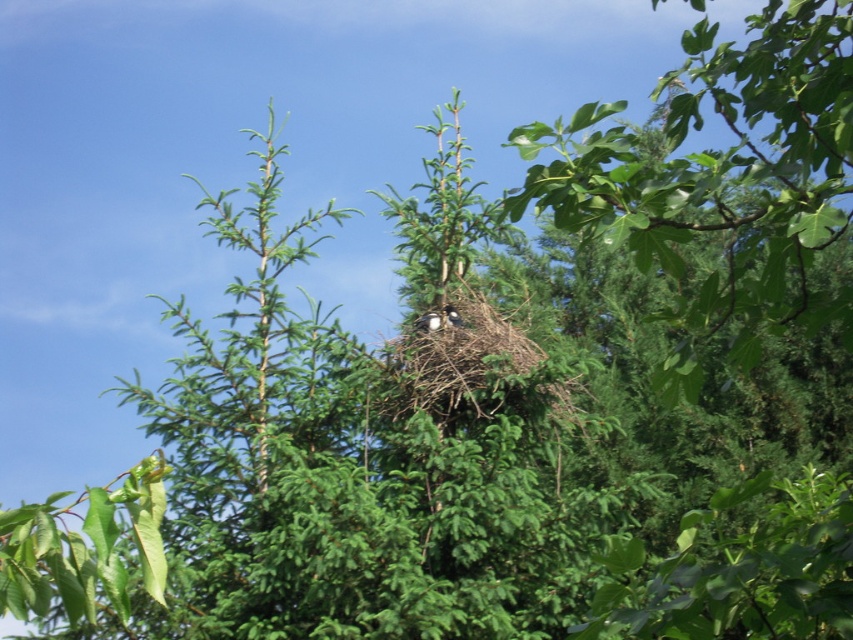
The width and height of the screenshot is (853, 640). Describe the element at coordinates (428, 321) in the screenshot. I see `white fluffy bird at center` at that location.

You are a GUI agent. You are given a task and a screenshot of the screen. Output one action in this format:
    pyautogui.click(x=<x>, y=<y>)
    Task: Click on the white fluffy bird at center
    
    Given the screenshot: What is the action you would take?
    pyautogui.click(x=428, y=321)